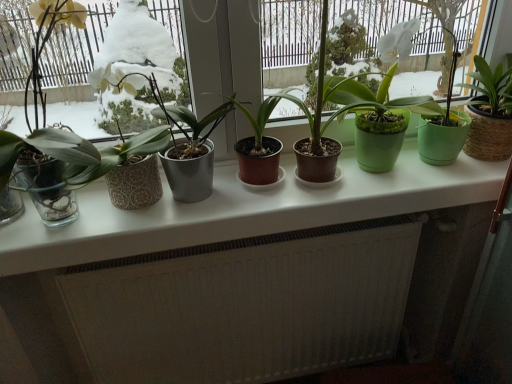
The width and height of the screenshot is (512, 384). Find the location of `matte black pot at center, the 3th houseplant viewed from the left`. matte black pot at center, the 3th houseplant viewed from the left is located at coordinates (202, 58).

This screenshot has height=384, width=512. I want to click on brown matte pot at center, placed as the 2th houseplant when sorted from left to right, so click(258, 145).

I want to click on metallic gray pot at center, arranged as the first houseplant when viewed from the left, so click(x=173, y=136).

Identify the location of white textured radiator at lower center. Image resolution: width=512 pixels, height=384 pixels. (245, 306).

Find the location of a particular element. Image resolution: width=512 pixels, height=384 pixels. matte black pot at center, the second houseplant viewed from the right is located at coordinates (202, 58).

From the image's perspective, which houseplant is the 2nd one below the transparent glass window at left? Please provide its 2D coordinates.

[(173, 136)]

Which is more to the left, metallic gray pot at center, which is the 4th houseplant in right-to-left order, or transparent glass window at left?

Positioned to the left is transparent glass window at left.

From the image's perspective, does metallic gray pot at center, arranged as the first houseplant when viewed from the left, appear higher than transparent glass window at left?

No.

Is transparent glass window at left inside metallic gray pot at center, which is the 4th houseplant in right-to-left order?

No.

Is white glossy counter top at center thinner than brown matte pot at center, placed as the 2th houseplant when sorted from left to right?

No, white glossy counter top at center is not thinner than brown matte pot at center, placed as the 2th houseplant when sorted from left to right.

Can you confirm if white glossy counter top at center is taller than brown matte pot at center, placed as the 2th houseplant when sorted from left to right?

No.

How different are the orientations of white glossy counter top at center and brown matte pot at center, which is the third houseplant from right to left, in degrees?

white glossy counter top at center and brown matte pot at center, which is the third houseplant from right to left, are facing 0.00015 degrees away from each other.

In terms of size, does white glossy counter top at center appear bigger or smaller than brown matte pot at center, placed as the 2th houseplant when sorted from left to right?

Clearly, white glossy counter top at center is larger in size than brown matte pot at center, placed as the 2th houseplant when sorted from left to right.

Is metallic gray pot at center, arranged as the first houseplant when viewed from the left, far away from green matte pot at center, the first houseplant in the right-to-left sequence?

No, metallic gray pot at center, arranged as the first houseplant when viewed from the left, is not far away from green matte pot at center, the first houseplant in the right-to-left sequence.

Could you measure the distance between metallic gray pot at center, arranged as the first houseplant when viewed from the left, and green matte pot at center, which appears as the 4th houseplant when viewed from the left?

They are 15.44 inches apart.

Does point (155, 114) appear closer or farther from the camera than point (341, 111)?

Point (155, 114).

Is metallic gray pot at center, which is the 4th houseplant in right-to-left order, facing away from green matte pot at center, which appears as the 4th houseplant when viewed from the left?

metallic gray pot at center, which is the 4th houseplant in right-to-left order, does not have its back to green matte pot at center, which appears as the 4th houseplant when viewed from the left.

Is transparent glass window at left to the right of matte black pot at center, the 3th houseplant viewed from the left, from the viewer's perspective?

Incorrect, transparent glass window at left is not on the right side of matte black pot at center, the 3th houseplant viewed from the left.

Is transparent glass window at left taller or shorter than matte black pot at center, the second houseplant viewed from the right?

Considering their sizes, transparent glass window at left has more height than matte black pot at center, the second houseplant viewed from the right.

Which point is more distant from viewer, (54, 67) or (248, 66)?

The point (54, 67) is farther from the camera.

From their relative heights in the image, would you say metallic gray pot at center, arranged as the first houseplant when viewed from the left, is taller or shorter than white textured radiator at lower center?

Considering their sizes, metallic gray pot at center, arranged as the first houseplant when viewed from the left, has less height than white textured radiator at lower center.

Do you think metallic gray pot at center, which is the 4th houseplant in right-to-left order, is within white textured radiator at lower center, or outside of it?

metallic gray pot at center, which is the 4th houseplant in right-to-left order, is not enclosed by white textured radiator at lower center.

Which object is closer to the camera taking this photo, metallic gray pot at center, which is the 4th houseplant in right-to-left order, or white textured radiator at lower center?

metallic gray pot at center, which is the 4th houseplant in right-to-left order.

Is metallic gray pot at center, arranged as the first houseplant when viewed from the left, oriented away from white textured radiator at lower center?

That's not correct — metallic gray pot at center, arranged as the first houseplant when viewed from the left, is not looking away from white textured radiator at lower center.

Which of these two, transparent glass window at left or green matte pot at center, the first houseplant in the right-to-left sequence, stands shorter?

green matte pot at center, the first houseplant in the right-to-left sequence, is shorter.

Between transparent glass window at left and green matte pot at center, the first houseplant in the right-to-left sequence, which one has larger size?

transparent glass window at left is bigger.

From a real-world perspective, who is located higher, transparent glass window at left or green matte pot at center, which appears as the 4th houseplant when viewed from the left?

transparent glass window at left is physically above.

Between transparent glass window at left and green matte pot at center, which appears as the 4th houseplant when viewed from the left, which one is positioned in front?

transparent glass window at left is in front.

Considering the relative sizes of matte black pot at center, the second houseplant viewed from the right, and brown matte pot at center, which is the third houseplant from right to left, in the image provided, is matte black pot at center, the second houseplant viewed from the right, smaller than brown matte pot at center, which is the third houseplant from right to left,?

Actually, matte black pot at center, the second houseplant viewed from the right, might be larger than brown matte pot at center, which is the third houseplant from right to left.

From a real-world perspective, which is physically below, matte black pot at center, the 3th houseplant viewed from the left, or brown matte pot at center, placed as the 2th houseplant when sorted from left to right?

brown matte pot at center, placed as the 2th houseplant when sorted from left to right.

Can you confirm if matte black pot at center, the 3th houseplant viewed from the left, is thinner than brown matte pot at center, placed as the 2th houseplant when sorted from left to right?

Yes, matte black pot at center, the 3th houseplant viewed from the left, is thinner than brown matte pot at center, placed as the 2th houseplant when sorted from left to right.

What's the angular difference between matte black pot at center, the 3th houseplant viewed from the left, and brown matte pot at center, placed as the 2th houseplant when sorted from left to right,'s facing directions?

The angle between the facing direction of matte black pot at center, the 3th houseplant viewed from the left, and the facing direction of brown matte pot at center, placed as the 2th houseplant when sorted from left to right, is 0.000195 degrees.

From the transparent glass window at left, count 1st houseplant to the right and point to it. Please provide its 2D coordinates.

[(173, 136)]

There is a white glossy counter top at center. What are the coordinates of `the 2nd houseplant above it (from a real-world perspective)` in the screenshot? It's located at (258, 145).

From the image, which object appears to be nearer to white textured radiator at lower center, metallic gray pot at center, arranged as the first houseplant when viewed from the left, or green matte pot at center, which appears as the 4th houseplant when viewed from the left?

Among the two, metallic gray pot at center, arranged as the first houseplant when viewed from the left, is located nearer to white textured radiator at lower center.

Considering their positions, is transparent glass window at left positioned further to matte black pot at center, the second houseplant viewed from the right, than white glossy counter top at center?

white glossy counter top at center.

Estimate the real-world distances between objects in this image. Which object is closer to white textured radiator at lower center, green matte pot at center, which appears as the 4th houseplant when viewed from the left, or metallic gray pot at center, arranged as the first houseplant when viewed from the left?

The object closer to white textured radiator at lower center is metallic gray pot at center, arranged as the first houseplant when viewed from the left.

Considering their positions, is green matte pot at center, the first houseplant in the right-to-left sequence, positioned closer to white textured radiator at lower center than white glossy counter top at center?

white glossy counter top at center lies closer to white textured radiator at lower center than the other object.

Estimate the real-world distances between objects in this image. Which object is further from matte black pot at center, the 3th houseplant viewed from the left, white textured radiator at lower center or transparent glass window at left?

Based on the image, white textured radiator at lower center appears to be further to matte black pot at center, the 3th houseplant viewed from the left.

Looking at the image, which one is located closer to green matte pot at center, the first houseplant in the right-to-left sequence, transparent glass window at left or white textured radiator at lower center?

Based on the image, white textured radiator at lower center appears to be nearer to green matte pot at center, the first houseplant in the right-to-left sequence.

When comparing their distances from matte black pot at center, the second houseplant viewed from the right, does green matte pot at center, the first houseplant in the right-to-left sequence, or metallic gray pot at center, which is the 4th houseplant in right-to-left order, seem further?

The object further to matte black pot at center, the second houseplant viewed from the right, is green matte pot at center, the first houseplant in the right-to-left sequence.

Considering their positions, is white textured radiator at lower center positioned further to transparent glass window at left than white glossy counter top at center?

white textured radiator at lower center is further to transparent glass window at left.

This screenshot has width=512, height=384. I want to click on window frame between matte black pot at center, the 3th houseplant viewed from the left, and white textured radiator at lower center vertically, so click(117, 66).

Find the location of a particular element. This screenshot has width=512, height=384. houseplant located between transparent glass window at left and brown matte pot at center, placed as the 2th houseplant when sorted from left to right, in the left-right direction is located at coordinates (173, 136).

Find the location of `houseplant situated between brown matte pot at center, placed as the 2th houseplant when sorted from left to right, and green matte pot at center, the first houseplant in the right-to-left sequence, from left to right`. houseplant situated between brown matte pot at center, placed as the 2th houseplant when sorted from left to right, and green matte pot at center, the first houseplant in the right-to-left sequence, from left to right is located at coordinates (202, 58).

The height and width of the screenshot is (384, 512). I want to click on counter top situated between transparent glass window at left and green matte pot at center, which appears as the 4th houseplant when viewed from the left, from left to right, so click(x=244, y=210).